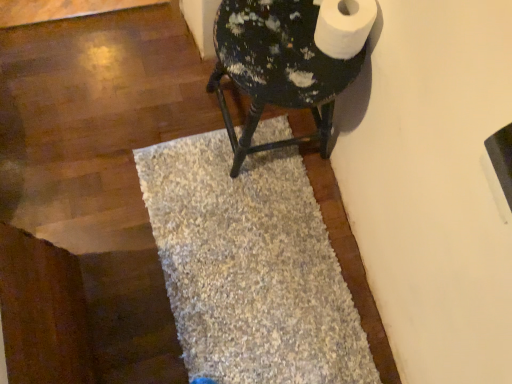
Question: Can you confirm if beige shaggy bath mat at center is taller than painted wood stool at upper right?

Choices:
 (A) no
 (B) yes

Answer: (A)

Question: Is beige shaggy bath mat at center at the right side of painted wood stool at upper right?

Choices:
 (A) yes
 (B) no

Answer: (B)

Question: Is beige shaggy bath mat at center positioned before painted wood stool at upper right?

Choices:
 (A) no
 (B) yes

Answer: (A)

Question: Is beige shaggy bath mat at center far away from painted wood stool at upper right?

Choices:
 (A) yes
 (B) no

Answer: (B)

Question: Does beige shaggy bath mat at center have a lesser height compared to painted wood stool at upper right?

Choices:
 (A) yes
 (B) no

Answer: (A)

Question: From the image's perspective, is painted wood stool at upper right above or below beige shaggy bath mat at center?

Choices:
 (A) below
 (B) above

Answer: (B)

Question: From a real-world perspective, is painted wood stool at upper right positioned above or below beige shaggy bath mat at center?

Choices:
 (A) below
 (B) above

Answer: (B)

Question: In terms of width, does painted wood stool at upper right look wider or thinner when compared to beige shaggy bath mat at center?

Choices:
 (A) thin
 (B) wide

Answer: (A)

Question: Relative to beige shaggy bath mat at center, is painted wood stool at upper right in front or behind?

Choices:
 (A) behind
 (B) front

Answer: (B)

Question: Considering the positions of painted wood stool at upper right and white matte toilet paper at upper right in the image, is painted wood stool at upper right wider or thinner than white matte toilet paper at upper right?

Choices:
 (A) thin
 (B) wide

Answer: (B)

Question: Is point (225, 44) positioned closer to the camera than point (360, 36)?

Choices:
 (A) farther
 (B) closer

Answer: (A)

Question: In the image, is painted wood stool at upper right on the left side or the right side of white matte toilet paper at upper right?

Choices:
 (A) right
 (B) left

Answer: (B)

Question: Do you think painted wood stool at upper right is within white matte toilet paper at upper right, or outside of it?

Choices:
 (A) inside
 (B) outside

Answer: (B)

Question: Is point (333, 1) closer or farther from the camera than point (218, 96)?

Choices:
 (A) closer
 (B) farther

Answer: (A)

Question: Is white matte toilet paper at upper right in front of or behind painted wood stool at upper right in the image?

Choices:
 (A) behind
 (B) front

Answer: (B)